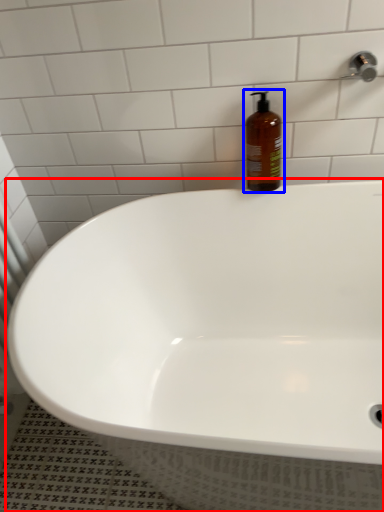
Question: Which object is closer to the camera taking this photo, bathtub (highlighted by a red box) or bottle (highlighted by a blue box)?

Choices:
 (A) bathtub
 (B) bottle

Answer: (A)